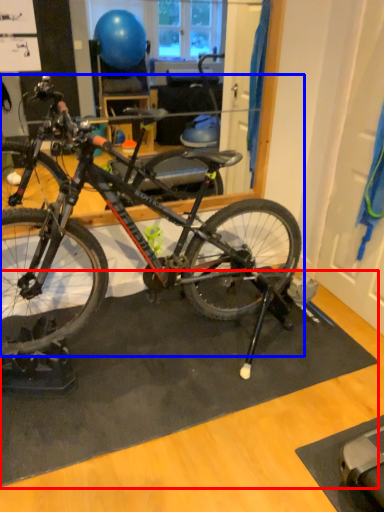
Question: Which object is closer to the camera taking this photo, doormat (highlighted by a red box) or bicycle (highlighted by a blue box)?

Choices:
 (A) doormat
 (B) bicycle

Answer: (B)